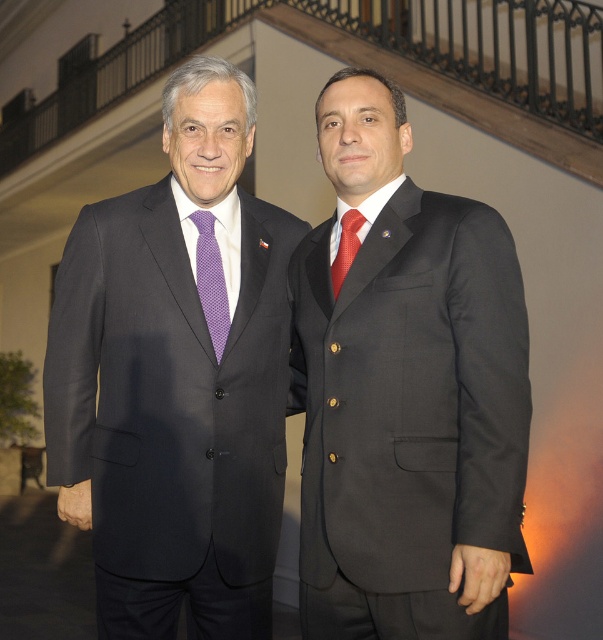
You are a photographer setting up a shoot in a room with a staircase and black wrought iron railings. You need to position a matte black suit at right and a red silk tie at center so that they are visible in the frame. Given their sizes, which object will appear larger in the photo?

The matte black suit at right is much taller than the red silk tie at center, so it will appear larger in the photo.

You are standing in the room where the two men are positioned. You want to walk towards the closer point between point [242,525] and point [356,244]. Which point should you walk towards?

Point [242,525] is closer to you than point [356,244], so you should walk towards point [242,525].